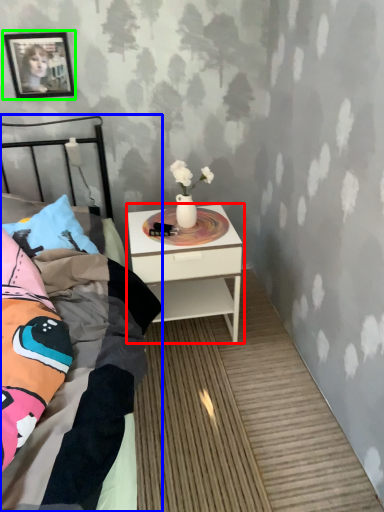
Question: Which object is positioned farthest from nightstand (highlighted by a red box)? Select from bed (highlighted by a blue box) and picture frame (highlighted by a green box).

Choices:
 (A) bed
 (B) picture frame

Answer: (B)